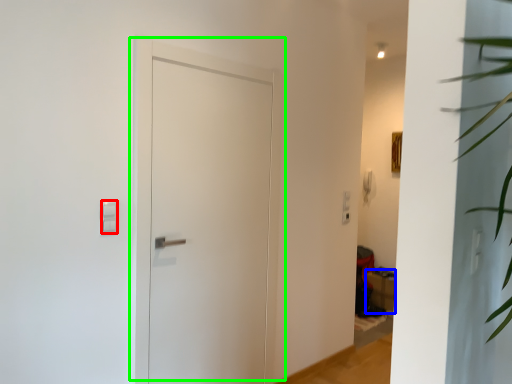
Question: Which is nearer to the light switch (highlighted by a red box)? furniture (highlighted by a blue box) or door (highlighted by a green box).

Choices:
 (A) furniture
 (B) door

Answer: (B)